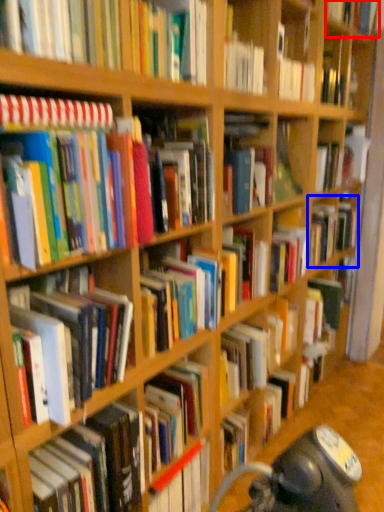
Question: Which object is further to the camera taking this photo, book (highlighted by a red box) or book (highlighted by a blue box)?

Choices:
 (A) book
 (B) book

Answer: (B)